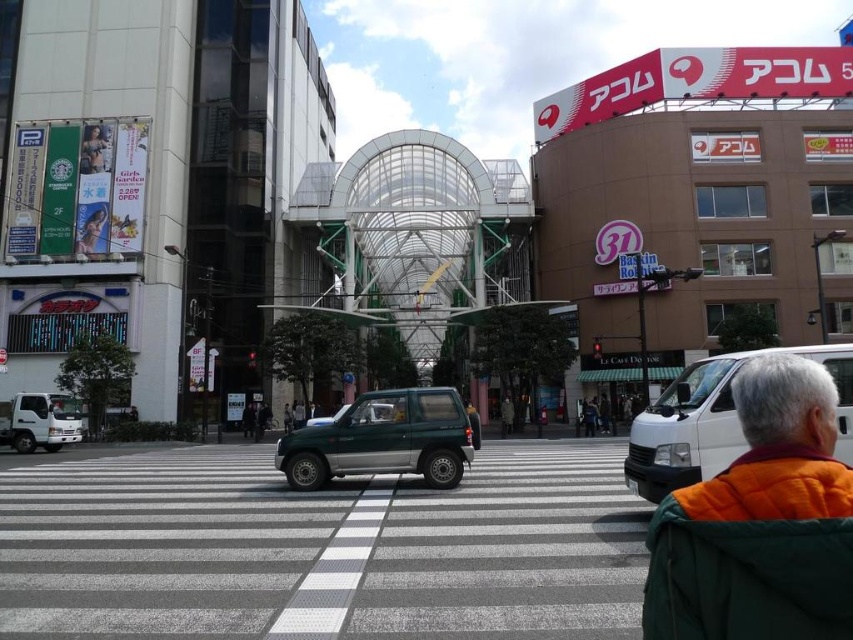
Can you confirm if green matte car at center is smaller than green matte suv at center?

No, green matte car at center is not smaller than green matte suv at center.

Is green matte car at center positioned before green matte suv at center?

No, it is not.

Between point (418, 152) and point (428, 404), which one is positioned behind?

The point (418, 152) is behind.

This screenshot has height=640, width=853. What are the coordinates of `green matte car at center` in the screenshot? It's located at (393, 205).

Which is more to the left, green matte car at center or metallic green car at center?

From the viewer's perspective, metallic green car at center appears more on the left side.

Measure the distance between green matte car at center and camera.

220.44 feet

Identify the location of green matte car at center. click(393, 205).

The height and width of the screenshot is (640, 853). What are the coordinates of `green matte car at center` in the screenshot? It's located at (393, 205).

Can you confirm if metallic green car at center is thinner than orange quilted jacket at lower right?

No.

Can you confirm if metallic green car at center is wider than orange quilted jacket at lower right?

Yes.

Which is behind, point (221, 556) or point (837, 529)?

Positioned behind is point (221, 556).

Locate an element on the screen. The height and width of the screenshot is (640, 853). metallic green car at center is located at coordinates (320, 547).